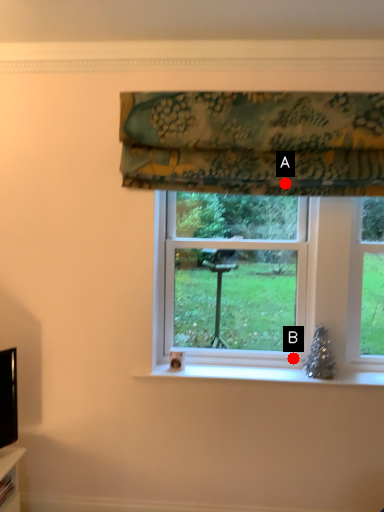
Question: Two points are circled on the image, labeled by A and B beside each circle. Which point is farther from the camera taking this photo?

Choices:
 (A) A is further
 (B) B is further

Answer: (B)